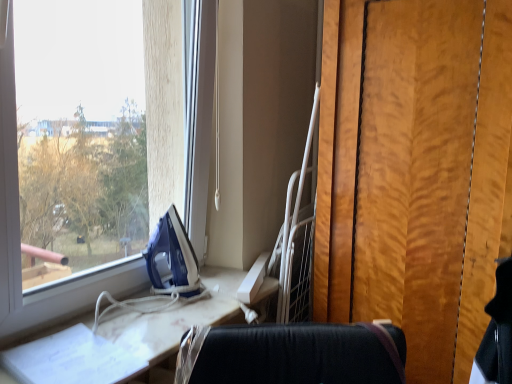
Question: From a real-world perspective, does blue plastic iron at window stand above white glossy ironing board at left?

Choices:
 (A) yes
 (B) no

Answer: (A)

Question: Does blue plastic iron at window appear on the right side of white glossy ironing board at left?

Choices:
 (A) yes
 (B) no

Answer: (A)

Question: Is white glossy ironing board at left at the back of blue plastic iron at window?

Choices:
 (A) no
 (B) yes

Answer: (A)

Question: Is blue plastic iron at window further to camera compared to white glossy ironing board at left?

Choices:
 (A) no
 (B) yes

Answer: (B)

Question: Is white glossy ironing board at left a part of blue plastic iron at window?

Choices:
 (A) no
 (B) yes

Answer: (A)

Question: Is blue plastic iron at window located outside white glossy ironing board at left?

Choices:
 (A) no
 (B) yes

Answer: (B)

Question: Can you confirm if white glossy ironing board at left is taller than blue plastic iron at window?

Choices:
 (A) yes
 (B) no

Answer: (B)

Question: Is white glossy ironing board at left behind blue plastic iron at window?

Choices:
 (A) yes
 (B) no

Answer: (B)

Question: Is white glossy ironing board at left far from blue plastic iron at window?

Choices:
 (A) no
 (B) yes

Answer: (A)

Question: Is white glossy ironing board at left positioned in front of blue plastic iron at window?

Choices:
 (A) yes
 (B) no

Answer: (A)

Question: Is white glossy ironing board at left turned away from blue plastic iron at window?

Choices:
 (A) yes
 (B) no

Answer: (B)

Question: Is white glossy ironing board at left positioned beyond the bounds of blue plastic iron at window?

Choices:
 (A) no
 (B) yes

Answer: (B)

Question: From the image's perspective, is blue plastic iron at window located above or below white glossy ironing board at left?

Choices:
 (A) below
 (B) above

Answer: (B)